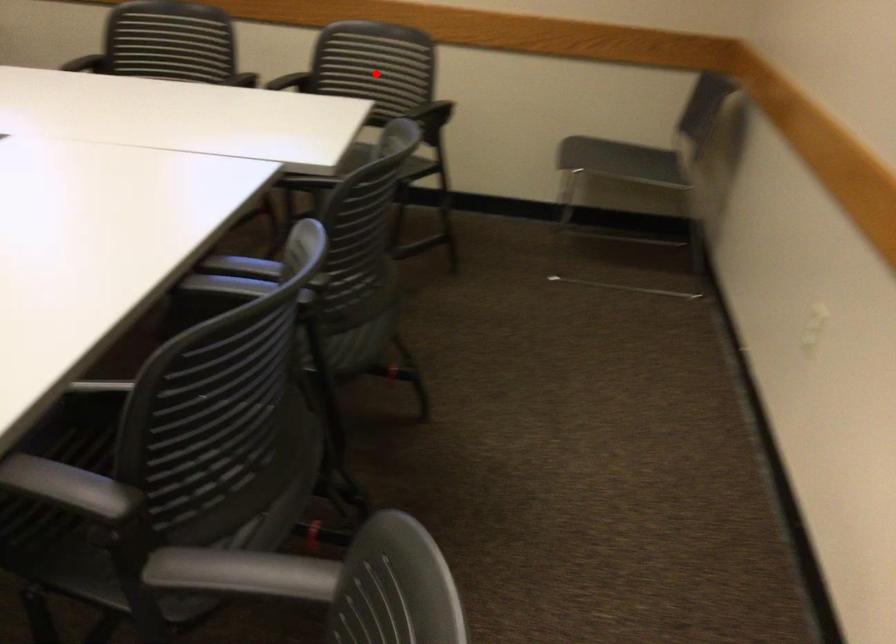
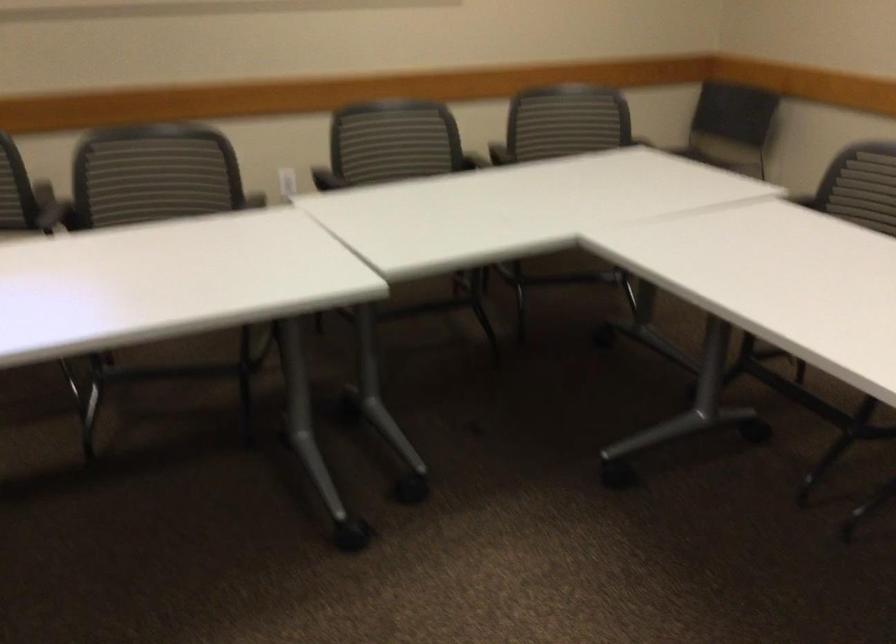
Question: I am providing you with two images of the same scene from different viewpoints. A red point is marked on the first image. At the location where the point appears in image 1, is it still visible in image 2?

Choices:
 (A) Yes
 (B) No

Answer: (B)